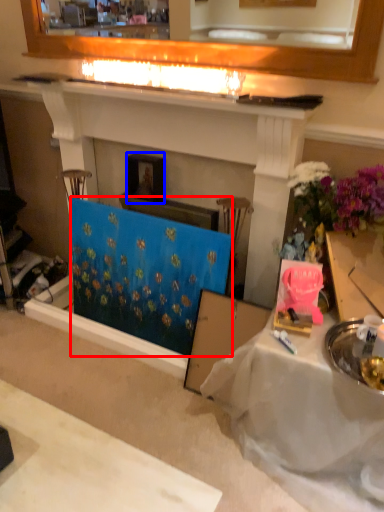
Question: Which of the following is the closest to the observer, curtain (highlighted by a red box) or picture frame (highlighted by a blue box)?

Choices:
 (A) curtain
 (B) picture frame

Answer: (A)